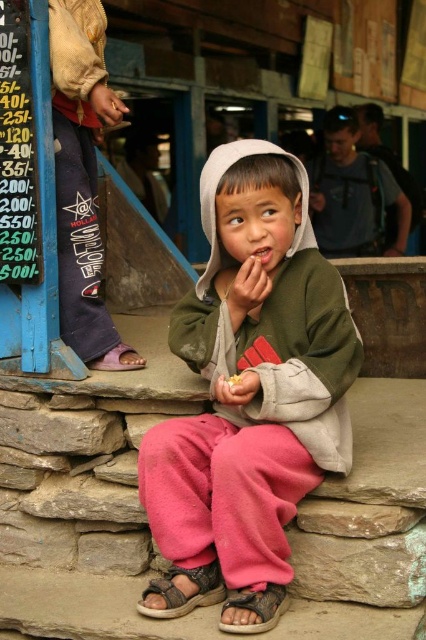
Is the position of brown textured sandal at lower center less distant than that of brown leather sandal at lower left?

Yes, brown textured sandal at lower center is in front of brown leather sandal at lower left.

Can you confirm if brown textured sandal at lower center is wider than brown leather sandal at lower left?

In fact, brown textured sandal at lower center might be narrower than brown leather sandal at lower left.

The image size is (426, 640). What are the coordinates of `brown textured sandal at lower center` in the screenshot? It's located at (256, 609).

Between pink fleece pants at center and yellow crumbly food at center, which one has more height?

pink fleece pants at center is taller.

Is point (334, 273) in front of point (236, 381)?

No, it is not.

I want to click on pink fleece pants at center, so click(x=256, y=371).

Consider the image. Is pink fleece pants at center bigger than brown leather sandal at lower left?

Yes.

Does pink fleece pants at center have a lesser height compared to brown leather sandal at lower left?

In fact, pink fleece pants at center may be taller than brown leather sandal at lower left.

Who is more forward, (227,445) or (132,353)?

Positioned in front is point (227,445).

At what (x,y) coordinates should I click in order to perform the action: click on pink fleece pants at center. Please return your answer as a coordinate pair (x, y). The image size is (426, 640). Looking at the image, I should click on (256, 371).